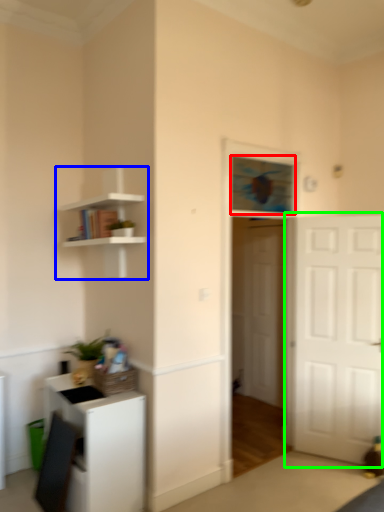
Question: Which is farther away from window (highlighted by a red box)? shelf (highlighted by a blue box) or door (highlighted by a green box)?

Choices:
 (A) shelf
 (B) door

Answer: (A)